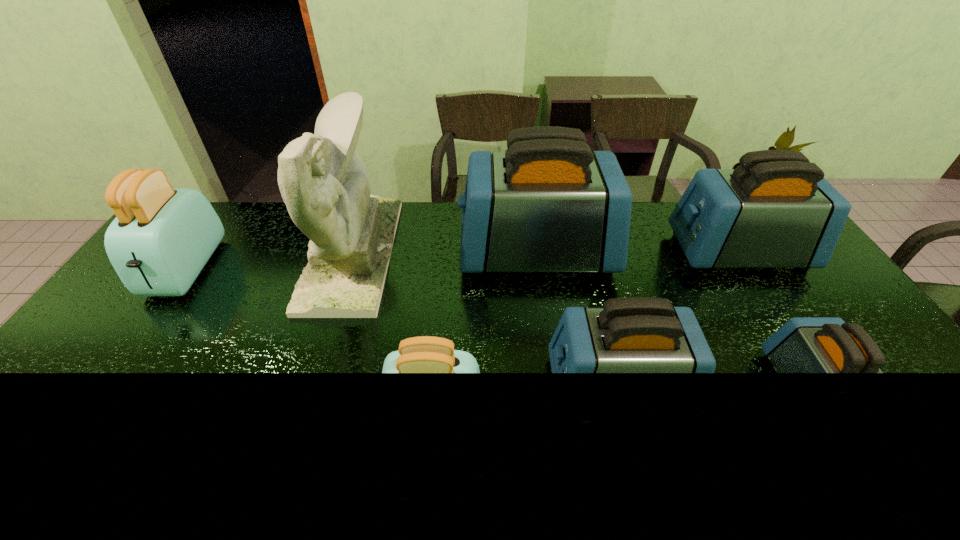
Identify the location of vacant space positioned on the front-facing side of the third biggest blue toaster. (497, 386).

Identify the location of vacant space located 0.250m on the front-facing side of the third biggest blue toaster. (449, 386).

You are a GUI agent. You are given a task and a screenshot of the screen. Output one action in this format:
    pyautogui.click(x=<x>, y=<y>)
    Task: Click on the vacant space located on the front-facing side of the third biggest blue toaster
    Image resolution: width=960 pixels, height=540 pixels.
    Given the screenshot: What is the action you would take?
    pyautogui.click(x=501, y=386)

Locate an element on the screen. free location located 0.210m on the side of the smaller light toaster with the lever is located at coordinates (574, 412).

Find the location of a particular element. Image resolution: width=960 pixels, height=540 pixels. sculpture that is at the far edge is located at coordinates (324, 182).

I want to click on object that is at the left edge, so coord(162,237).

What are the coordinates of `object that is at the right edge` in the screenshot? It's located at (775, 210).

The image size is (960, 540). What are the coordinates of `object situated at the far left corner` in the screenshot? It's located at (162, 237).

Locate an element on the screen. The height and width of the screenshot is (540, 960). object that is positioned at the far right corner is located at coordinates (775, 210).

In the image, there is a desktop. At what (x,y) coordinates should I click in order to perform the action: click on free space at the far edge. Please return your answer as a coordinate pair (x, y). This screenshot has height=540, width=960. Looking at the image, I should click on (284, 238).